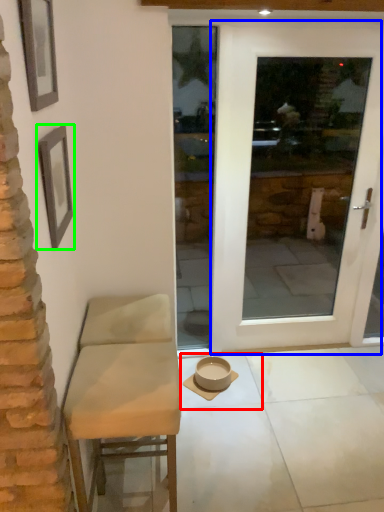
Question: Considering the real-world distances, which object is closest to tile (highlighted by a red box)? door (highlighted by a blue box) or picture frame (highlighted by a green box).

Choices:
 (A) door
 (B) picture frame

Answer: (A)